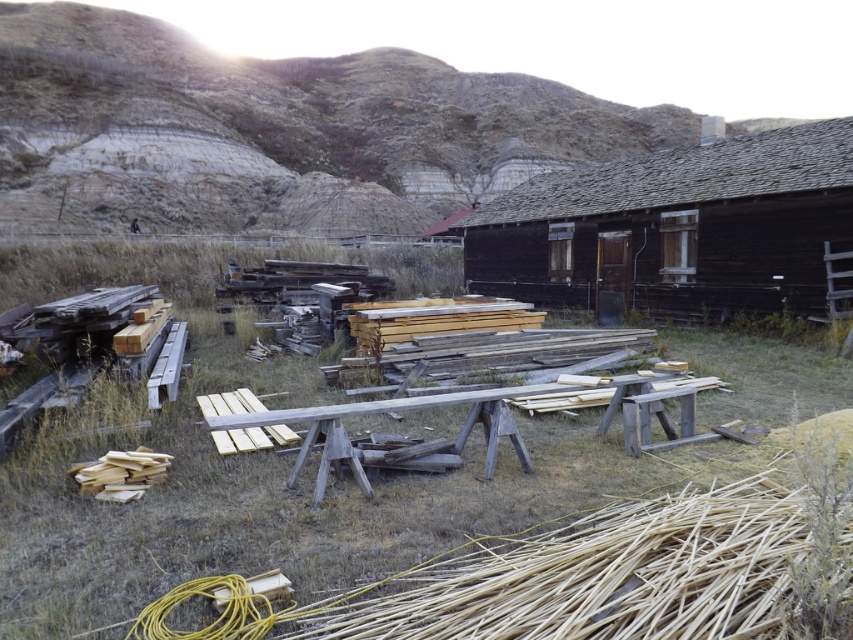
Question: Estimate the real-world distances between objects in this image. Which object is farther from the green grass at center?

Choices:
 (A) wooden picnic table at center
 (B) dark brown wooden cabin at center

Answer: (B)

Question: Can you confirm if dark brown wooden cabin at center is positioned above wooden picnic table at center?

Choices:
 (A) no
 (B) yes

Answer: (B)

Question: Which of these objects is positioned farthest from the green grass at center?

Choices:
 (A) dark brown wooden cabin at center
 (B) wooden picnic table at center

Answer: (A)

Question: Is dark brown wooden cabin at center below wooden picnic table at center?

Choices:
 (A) no
 (B) yes

Answer: (A)

Question: Estimate the real-world distances between objects in this image. Which object is farther from the green grass at center?

Choices:
 (A) wooden picnic table at center
 (B) dark brown wooden cabin at center

Answer: (B)

Question: Where is green grass at center located in relation to dark brown wooden cabin at center in the image?

Choices:
 (A) below
 (B) above

Answer: (A)